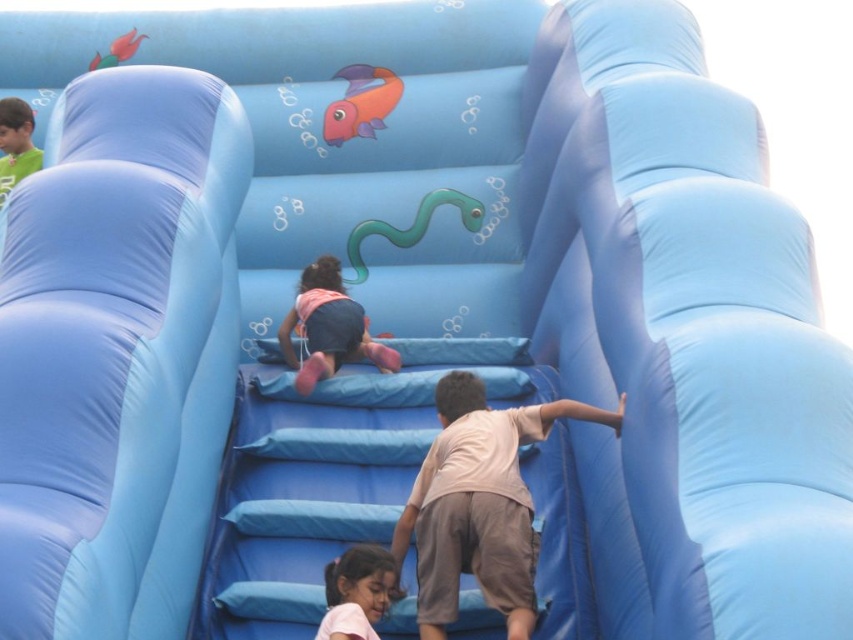
Question: Does blue fabric slide at center appear over matte pink shorts at lower center?

Choices:
 (A) yes
 (B) no

Answer: (A)

Question: Considering the real-world distances, which object is farthest from the matte pink shorts at lower center?

Choices:
 (A) light brown cotton shirt at center
 (B) blue fabric slide at center
 (C) blue fabric slide at right
 (D) pink fabric shorts at center

Answer: (C)

Question: Based on their relative distances, which object is farther from the blue fabric slide at right?

Choices:
 (A) blue fabric slide at center
 (B) pink fabric shorts at center
 (C) light brown cotton shirt at center

Answer: (A)

Question: Observing the image, what is the correct spatial positioning of light brown cotton shirt at center in reference to matte pink shorts at lower center?

Choices:
 (A) right
 (B) left

Answer: (A)

Question: Among these objects, which one is farthest from the camera?

Choices:
 (A) matte pink shorts at lower center
 (B) pink fabric shorts at center
 (C) light brown cotton shirt at center
 (D) blue fabric slide at center

Answer: (B)

Question: Is blue fabric slide at center smaller than light brown cotton shirt at center?

Choices:
 (A) yes
 (B) no

Answer: (B)